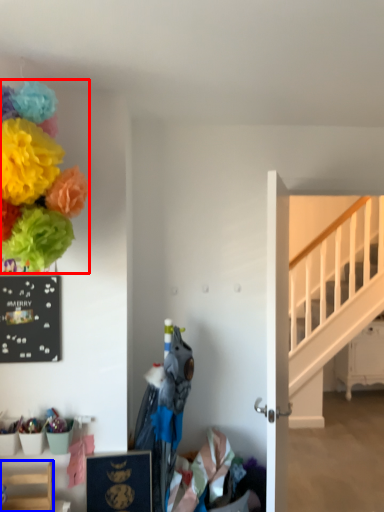
Question: Among these objects, which one is farthest to the camera, flower (highlighted by a red box) or furniture (highlighted by a blue box)?

Choices:
 (A) flower
 (B) furniture

Answer: (B)